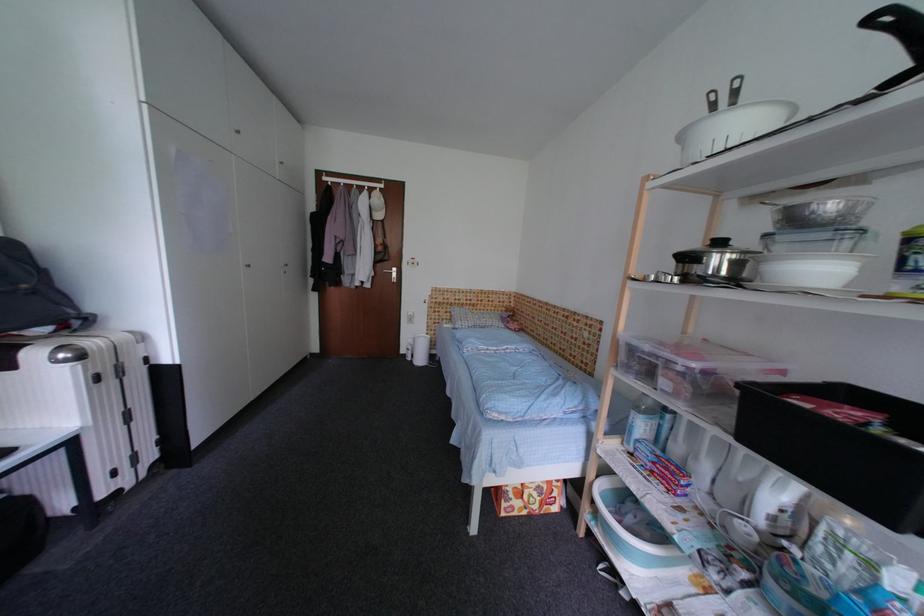
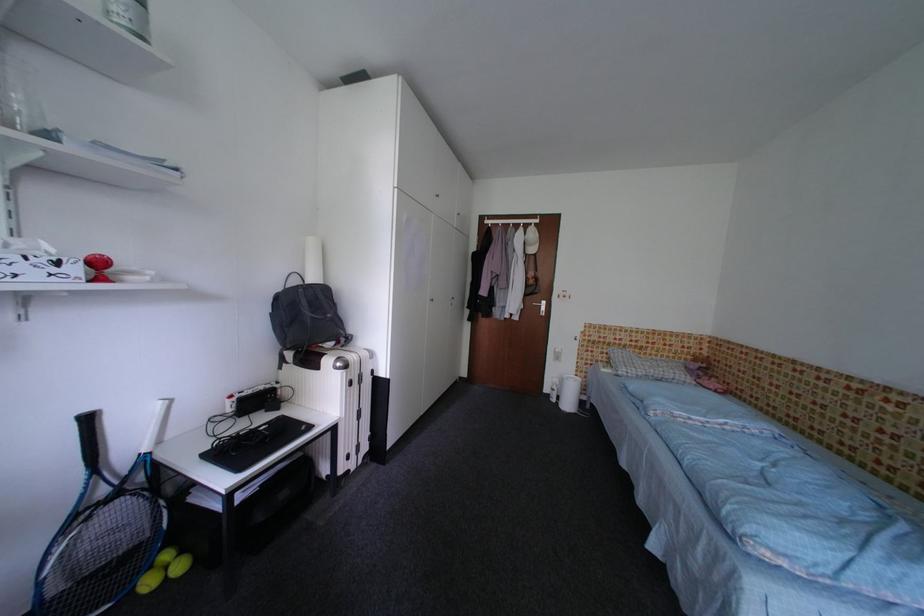
In the second image, find the point that corresponds to pixel 386 267 in the first image.

(536, 300)